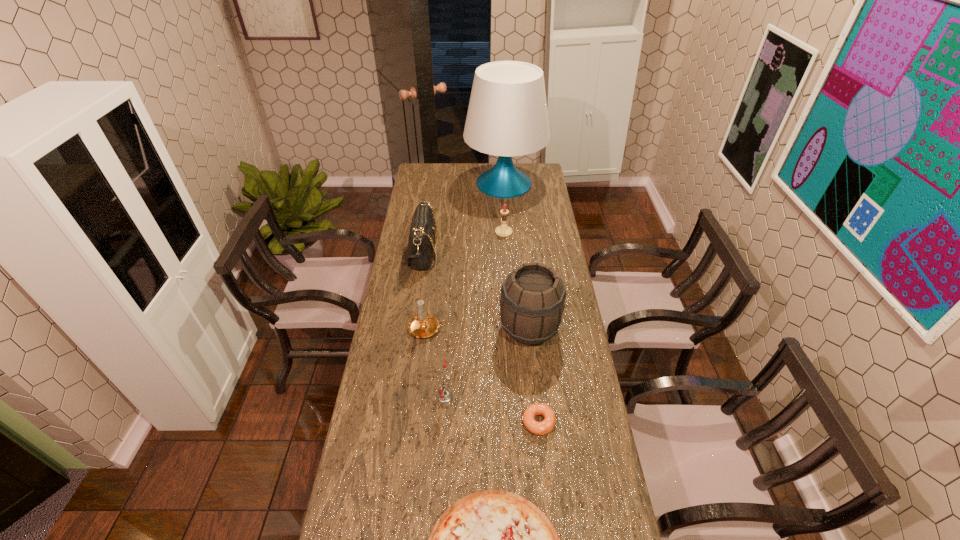
Identify the location of free space between the nearest candle and the second nearest candle. The image size is (960, 540). (436, 362).

This screenshot has height=540, width=960. I want to click on object that is the third closest to the third tallest object, so click(503, 231).

Identify which object is located as the third nearest to the table lamp. Please provide its 2D coordinates. Your answer should be formatted as a tuple, i.e. [(x, y)], where the tuple contains the x and y coordinates of a point satisfying the conditions above.

[(532, 302)]

The height and width of the screenshot is (540, 960). In order to click on the third closest candle relative to the nearest object in this screenshot , I will do `click(503, 231)`.

Find the location of a particular element. the closest candle to the second nearest candle is located at coordinates (444, 395).

Where is `vacant region that satisfies the following two spatial constraints: 1. on the front-facing side of the tallest object; 2. at the front of the third tallest object with chain and zipper`? Image resolution: width=960 pixels, height=540 pixels. vacant region that satisfies the following two spatial constraints: 1. on the front-facing side of the tallest object; 2. at the front of the third tallest object with chain and zipper is located at coordinates (510, 252).

Identify the location of free space that satisfies the following two spatial constraints: 1. on the front-facing side of the wine bucket; 2. on the right side of the tallest object. (516, 329).

Identify the location of vacant area that satisfies the following two spatial constraints: 1. on the front-facing side of the farthest object; 2. at the front of the sixth shortest object with chain and zipper. This screenshot has width=960, height=540. (510, 252).